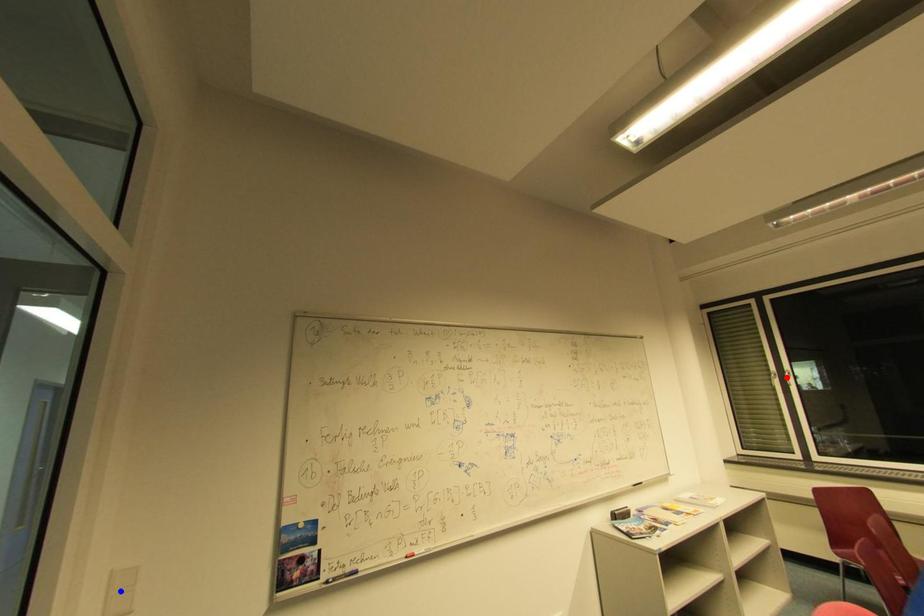
Question: Which of the two points in the image is closer to the camera?

Choices:
 (A) Blue point is closer.
 (B) Red point is closer.

Answer: (A)